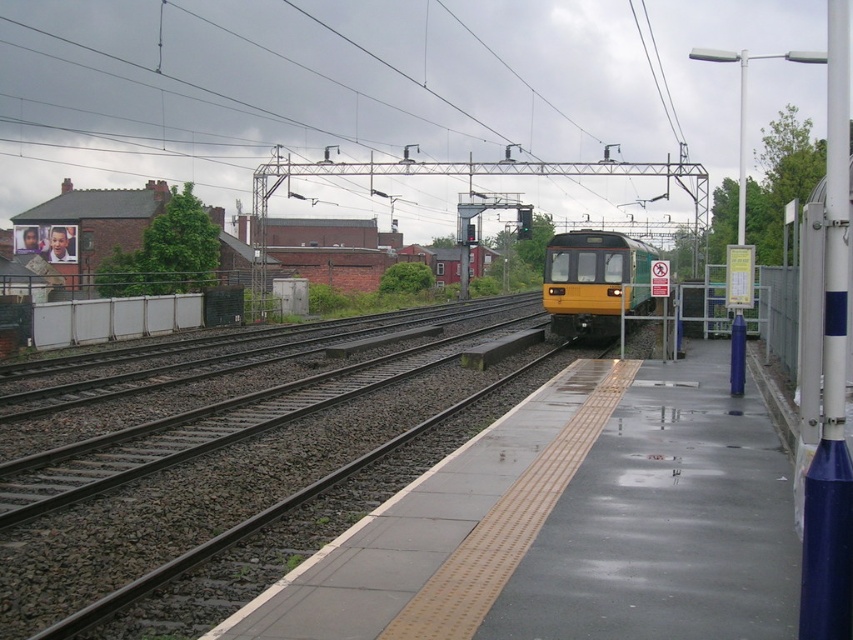
Question: Which of the following is the closest to the observer?

Choices:
 (A) (595, 257)
 (B) (508, 460)

Answer: (B)

Question: Which object is closer to the camera taking this photo?

Choices:
 (A) smooth concrete platform at center
 (B) yellow matte train at center

Answer: (A)

Question: Which point is closer to the camera?

Choices:
 (A) (592, 307)
 (B) (759, 609)

Answer: (B)

Question: In this image, where is smooth concrete platform at center located relative to yellow matte train at center?

Choices:
 (A) below
 (B) above

Answer: (A)

Question: Can you confirm if smooth concrete platform at center is smaller than yellow matte train at center?

Choices:
 (A) yes
 (B) no

Answer: (A)

Question: Can you confirm if smooth concrete platform at center is bigger than yellow matte train at center?

Choices:
 (A) yes
 (B) no

Answer: (B)